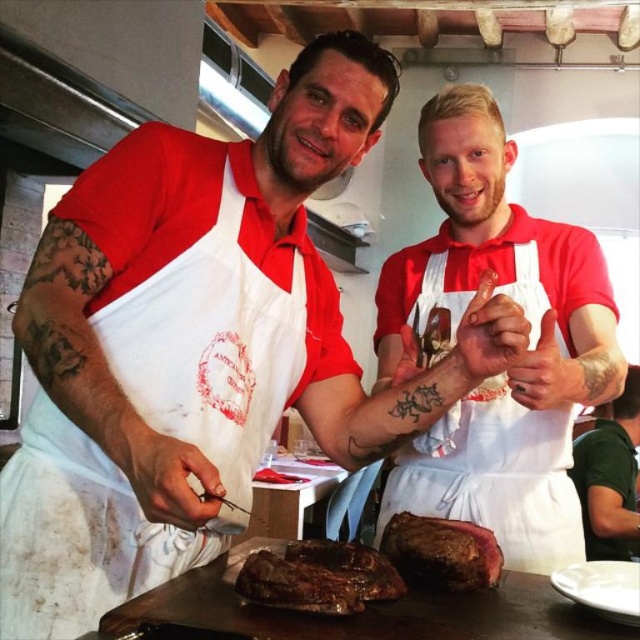
Question: Which point appears farthest from the camera in this image?

Choices:
 (A) (605, 456)
 (B) (253, 342)
 (C) (330, 612)
 (D) (552, 438)

Answer: (A)

Question: In this image, where is grilled meat at center located relative to brown crispy steak at center?

Choices:
 (A) above
 (B) below

Answer: (A)

Question: Where is white apron at center located in relation to green matte shirt at upper right in the image?

Choices:
 (A) above
 (B) below

Answer: (A)

Question: Which of these objects is positioned farthest from the white cotton apron at center?

Choices:
 (A) white apron at center
 (B) grilled meat at center

Answer: (A)

Question: Can you confirm if white apron at center is positioned to the left of green matte shirt at upper right?

Choices:
 (A) yes
 (B) no

Answer: (A)

Question: Which point is farther to the camera?

Choices:
 (A) green matte shirt at upper right
 (B) brown crispy steak at center
 (C) grilled meat at center
 (D) white cotton apron at center

Answer: (A)